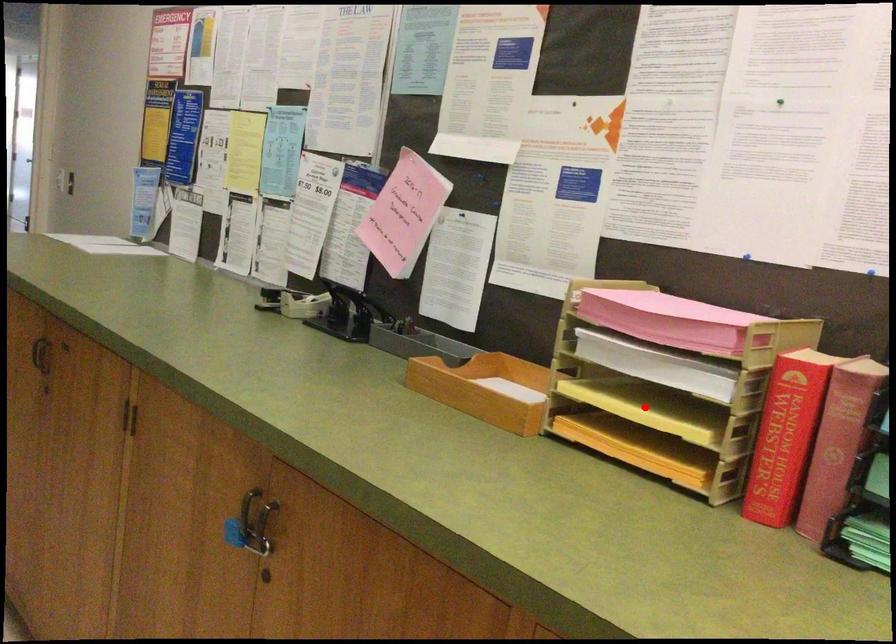
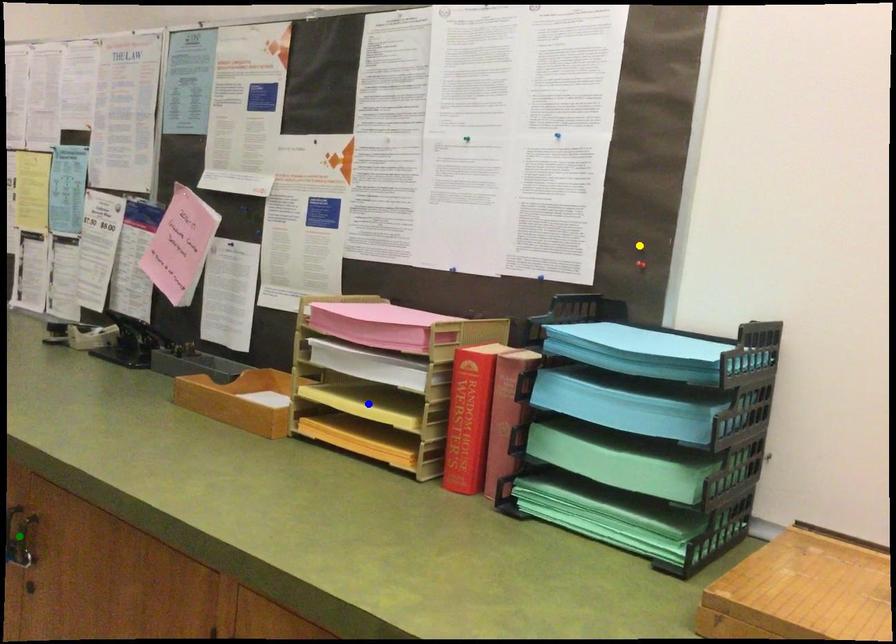
Question: I am providing you with two images of the same scene from different viewpoints. A red point is marked on the first image. You are given multiple points on the second image. Can you choose the point in image 2 that corresponds to the point in image 1?

Choices:
 (A) blue point
 (B) yellow point
 (C) green point

Answer: (A)